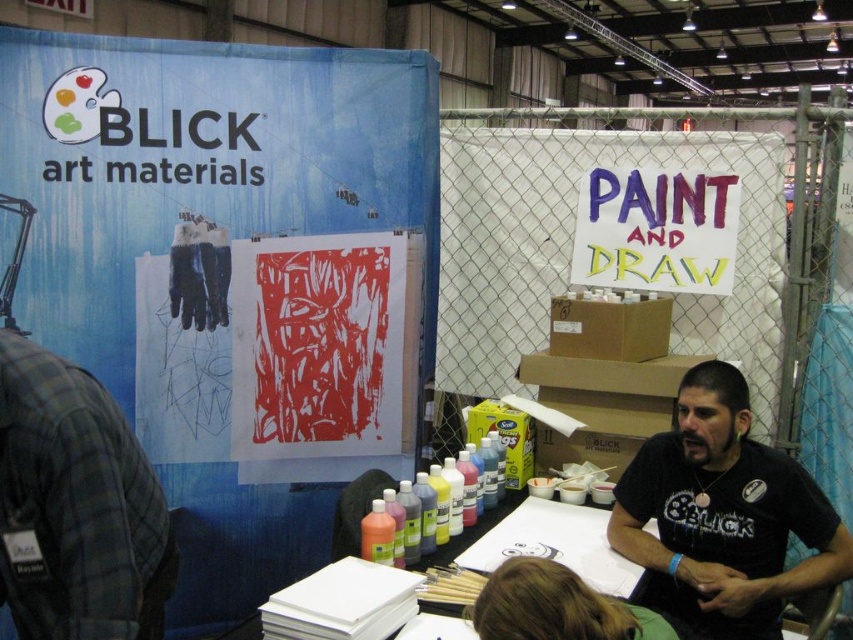
Consider the image. Where is the plaid flannel shirt at left located in the image?

The plaid flannel shirt at left is located at point (x=76, y=506) in the image.

You are standing in front of the BLICK art materials booth at the exhibition. You see a point marked at coordinate (318, 346). What object is located at that point?

The point at coordinate (318, 346) indicates the red linoleum print at center.

You are an artist attending the trade show and notice two items at the center of the booth. Which item is positioned lower down between the red linoleum print at center and the matte paint sign at center?

The red linoleum print at center is positioned lower than the matte paint sign at center.